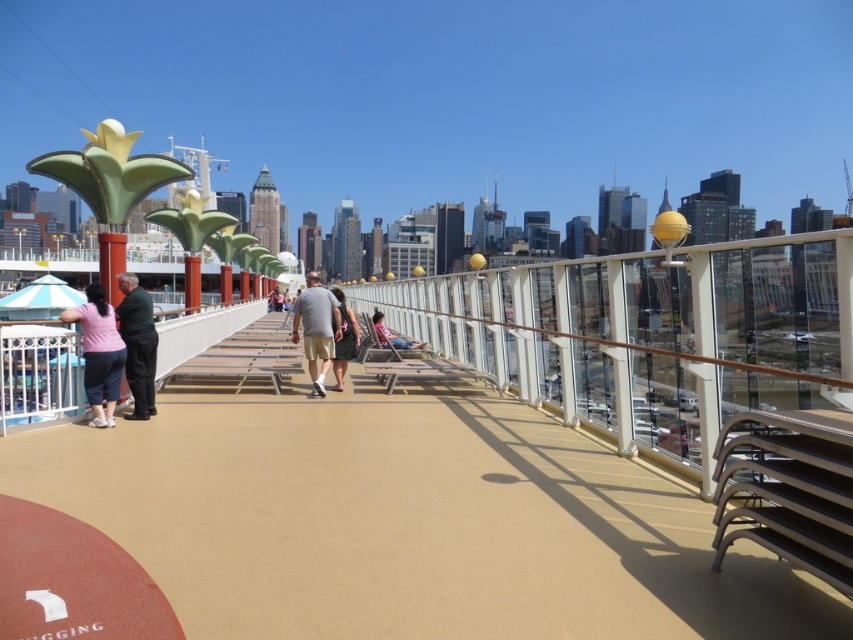
You are a passenger on the cruise ship and want to sit down on the beige rubber deck at center. However, you notice a dark green fabric jacket at left nearby. Can you sit there without the jacket interfering?

The beige rubber deck at center is smaller than the dark green fabric jacket at left, so the jacket might be taking up space on the deck. It is possible that sitting there could be difficult or the jacket might be in the way.